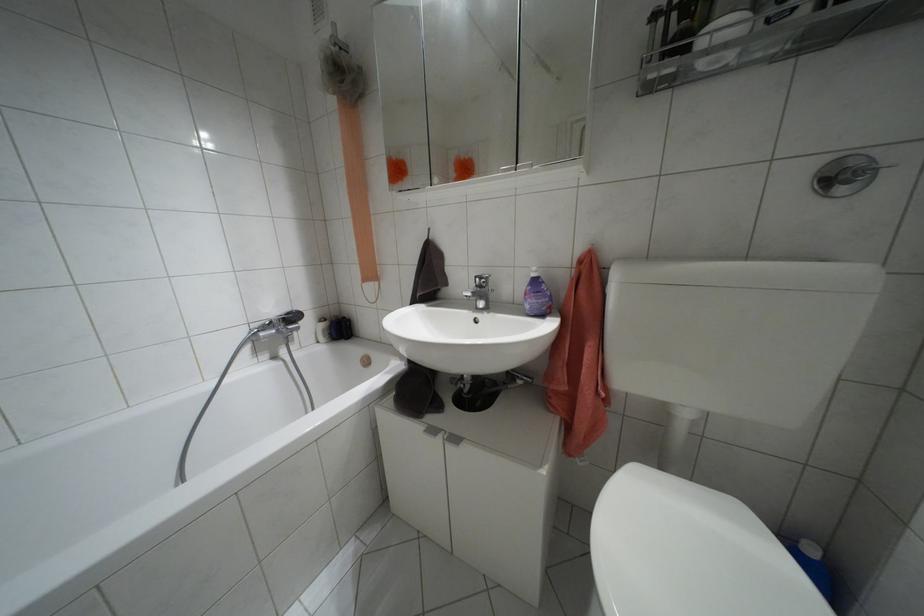
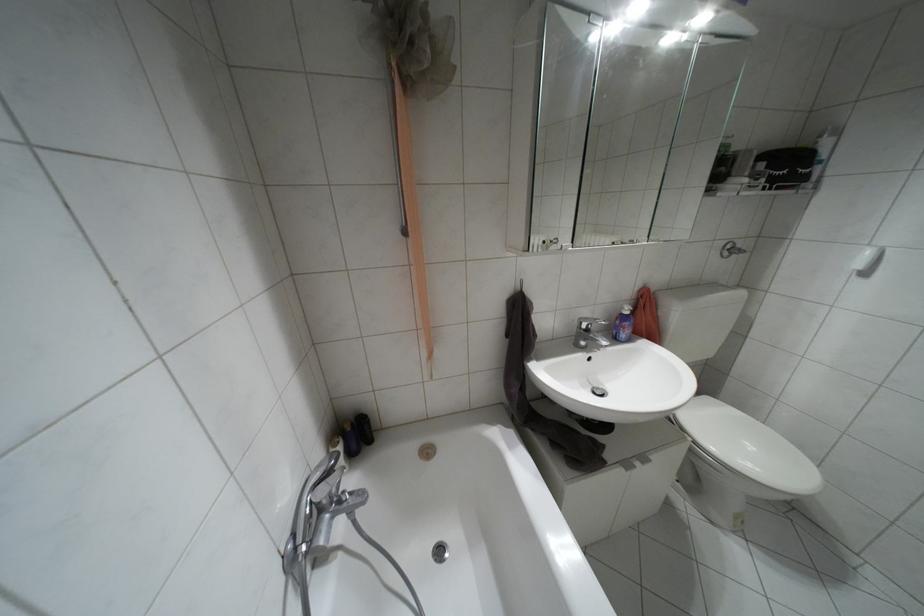
Locate, in the second image, the point that corresponds to (x=532, y=274) in the first image.

(626, 312)